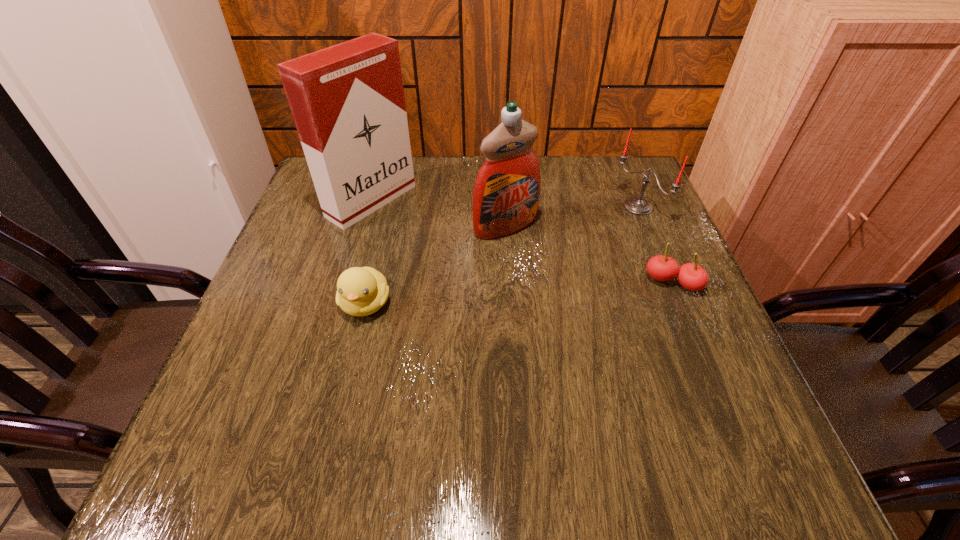
Image resolution: width=960 pixels, height=540 pixels. I want to click on candle positioned at the right edge, so click(x=636, y=205).

Where is `object located at the far left corner`? The width and height of the screenshot is (960, 540). object located at the far left corner is located at coordinates (347, 100).

Find the location of a particular element. The width and height of the screenshot is (960, 540). object located in the far right corner section of the desktop is located at coordinates [x=636, y=205].

What are the coordinates of `vacant space at the far edge` in the screenshot? It's located at (447, 195).

This screenshot has width=960, height=540. Identify the location of vacant area at the near edge. (395, 388).

This screenshot has height=540, width=960. In the image, there is a desktop. What are the coordinates of `free region at the left edge` in the screenshot? It's located at (338, 260).

Locate an element on the screen. vacant space at the right edge of the desktop is located at coordinates (653, 225).

Find the location of `free space that is in between the cherry and the duckling`. free space that is in between the cherry and the duckling is located at coordinates (519, 293).

The image size is (960, 540). I want to click on vacant space in between the duckling and the third tallest object, so click(x=502, y=255).

Identify the location of vacant area that lies between the fourth shortest object and the duckling. (436, 265).